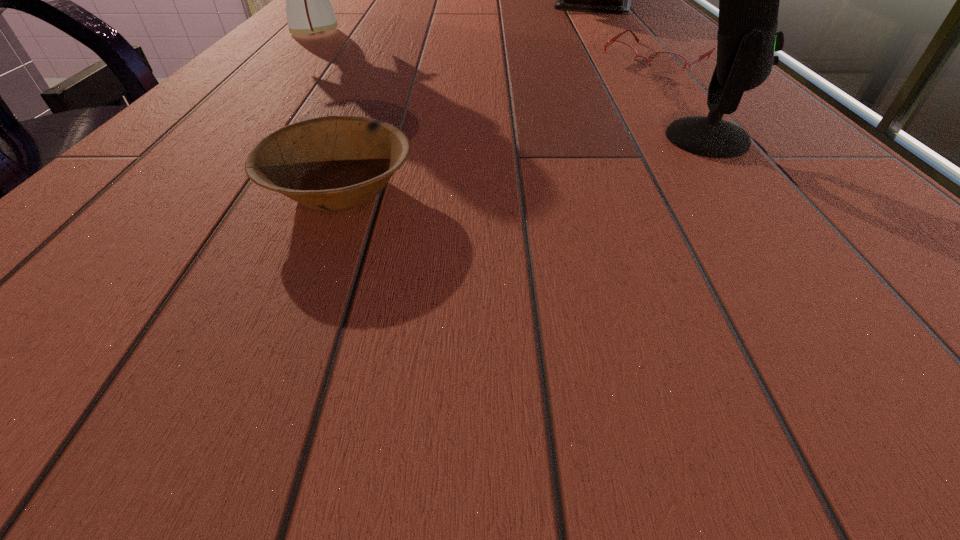
At what (x,y) coordinates should I click in order to perform the action: click on vacant space located on the lenses of the spectacles. Please return your answer as a coordinate pair (x, y). Looking at the image, I should click on (612, 90).

The width and height of the screenshot is (960, 540). Find the location of `blank area located 0.350m at the front face of the leftmost object`. blank area located 0.350m at the front face of the leftmost object is located at coordinates (426, 89).

Find the location of a particular element. vacant area situated at the front face of the leftmost object is located at coordinates (369, 60).

The width and height of the screenshot is (960, 540). Find the location of `vacant space located at the front face of the leftmost object`. vacant space located at the front face of the leftmost object is located at coordinates (416, 84).

At what (x,y) coordinates should I click in order to perform the action: click on object at the near edge. Please return your answer as a coordinate pair (x, y). Looking at the image, I should click on (331, 163).

Where is `object positioned at the left edge`? The width and height of the screenshot is (960, 540). object positioned at the left edge is located at coordinates (308, 8).

The width and height of the screenshot is (960, 540). I want to click on microphone located in the right edge section of the desktop, so click(x=749, y=0).

Where is `spectacles at the right edge`? The width and height of the screenshot is (960, 540). spectacles at the right edge is located at coordinates point(665,64).

In order to click on free point at the near edge in this screenshot , I will do `click(649, 239)`.

In the image, there is a desktop. At what (x,y) coordinates should I click in order to perform the action: click on blank space at the left edge. Please return your answer as a coordinate pair (x, y). Looking at the image, I should click on (348, 3).